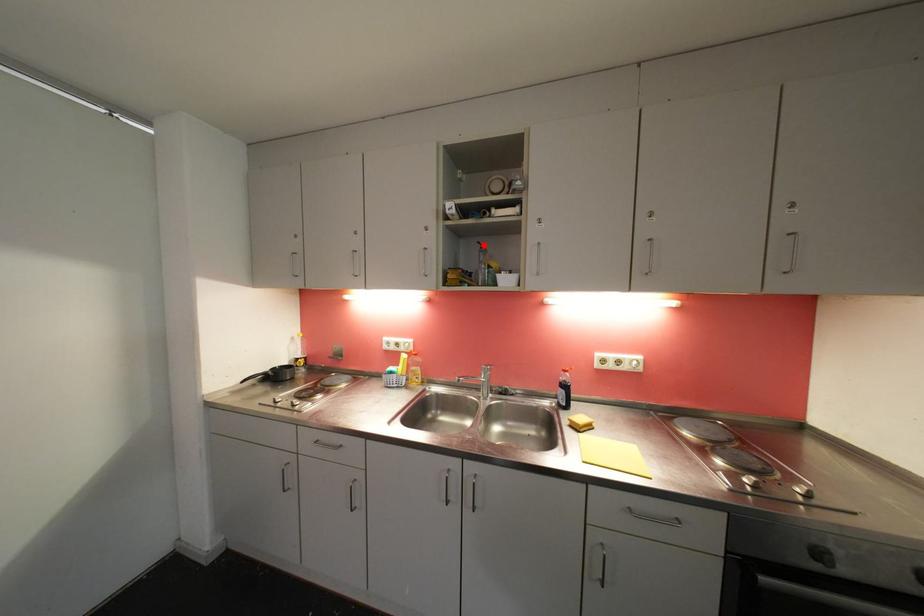
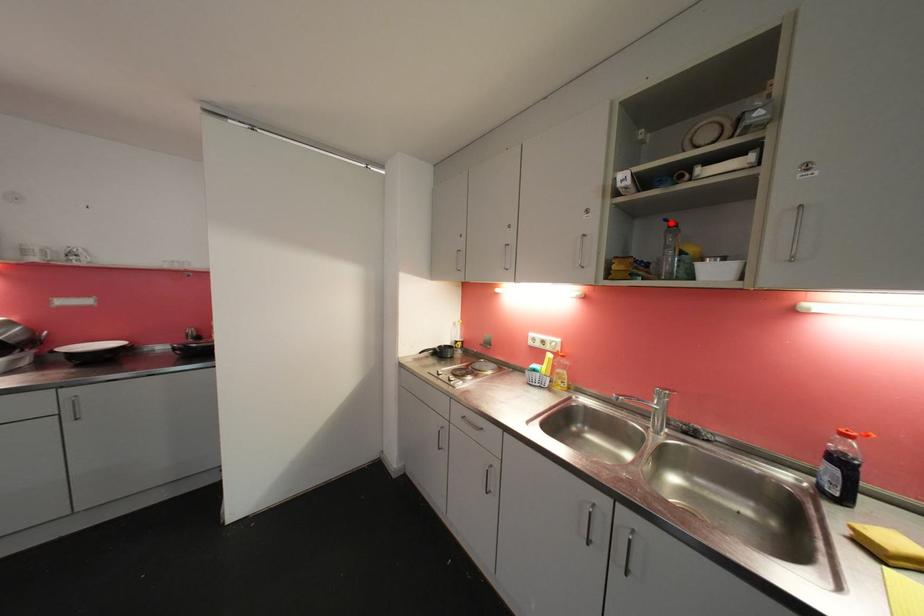
I am providing you with two images of the same scene from different viewpoints. A red point is marked on the first image and another point is marked on the second image. Are the points marked in image1 and image2 representing the same 3D position?

Yes